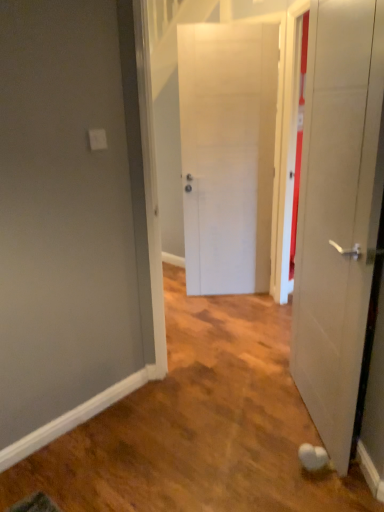
Question: Considering the relative sizes of white matte door at right, marked as the first door in a front-to-back arrangement, and white matte door at center, the second door viewed from the front, in the image provided, is white matte door at right, marked as the first door in a front-to-back arrangement, shorter than white matte door at center, the second door viewed from the front,?

Choices:
 (A) yes
 (B) no

Answer: (A)

Question: From the image's perspective, is white matte door at right, placed as the second door when sorted from back to front, above white matte door at center, the 1th door positioned from the back?

Choices:
 (A) no
 (B) yes

Answer: (A)

Question: Can you confirm if white matte door at right, marked as the first door in a front-to-back arrangement, is positioned to the left of white matte door at center, the second door viewed from the front?

Choices:
 (A) no
 (B) yes

Answer: (A)

Question: Does white matte door at right, marked as the first door in a front-to-back arrangement, have a greater width compared to white matte door at center, the second door viewed from the front?

Choices:
 (A) no
 (B) yes

Answer: (B)

Question: From the image's perspective, is white matte door at right, placed as the second door when sorted from back to front, below white matte door at center, the 1th door positioned from the back?

Choices:
 (A) yes
 (B) no

Answer: (A)

Question: Does white matte door at right, placed as the second door when sorted from back to front, have a greater height compared to white matte door at center, the 1th door positioned from the back?

Choices:
 (A) yes
 (B) no

Answer: (B)

Question: Does white matte door at center, the 1th door positioned from the back, have a lesser width compared to white matte door at right, marked as the first door in a front-to-back arrangement?

Choices:
 (A) no
 (B) yes

Answer: (B)

Question: Is white matte door at center, the second door viewed from the front, looking in the opposite direction of white matte door at right, placed as the second door when sorted from back to front?

Choices:
 (A) yes
 (B) no

Answer: (B)

Question: Can you confirm if white matte door at center, the 1th door positioned from the back, is positioned to the right of white matte door at right, marked as the first door in a front-to-back arrangement?

Choices:
 (A) yes
 (B) no

Answer: (B)

Question: From the image's perspective, is white matte door at center, the 1th door positioned from the back, under white matte door at right, marked as the first door in a front-to-back arrangement?

Choices:
 (A) yes
 (B) no

Answer: (B)

Question: Considering the relative sizes of white matte door at center, the 1th door positioned from the back, and white matte door at right, marked as the first door in a front-to-back arrangement, in the image provided, is white matte door at center, the 1th door positioned from the back, bigger than white matte door at right, marked as the first door in a front-to-back arrangement,?

Choices:
 (A) yes
 (B) no

Answer: (B)

Question: From the image's perspective, is white matte door at center, the 1th door positioned from the back, above white matte door at right, marked as the first door in a front-to-back arrangement?

Choices:
 (A) yes
 (B) no

Answer: (A)

Question: Considering the positions of white matte door at right, marked as the first door in a front-to-back arrangement, and white matte door at center, the second door viewed from the front, in the image, is white matte door at right, marked as the first door in a front-to-back arrangement, bigger or smaller than white matte door at center, the second door viewed from the front,?

Choices:
 (A) big
 (B) small

Answer: (A)